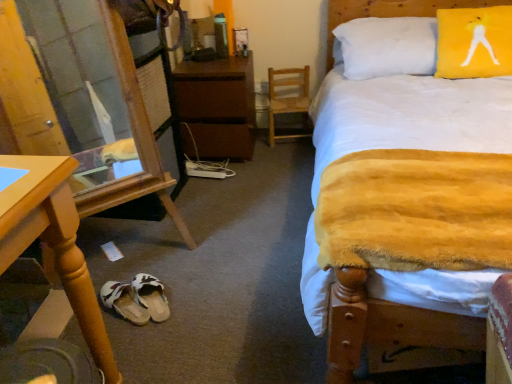
This screenshot has width=512, height=384. Identify the location of free point in front of brown matte nightstand at center. (240, 179).